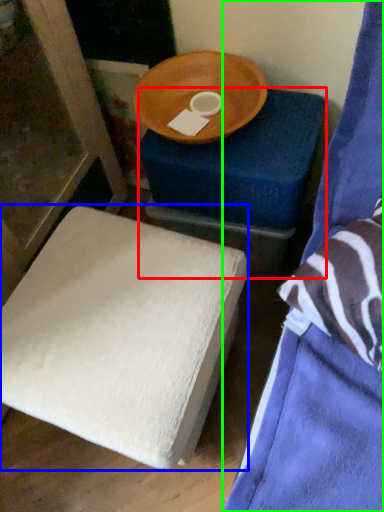
Question: Which object is the closest to the furniture (highlighted by a red box)? Choose among these: furniture (highlighted by a blue box) or furniture (highlighted by a green box).

Choices:
 (A) furniture
 (B) furniture

Answer: (B)